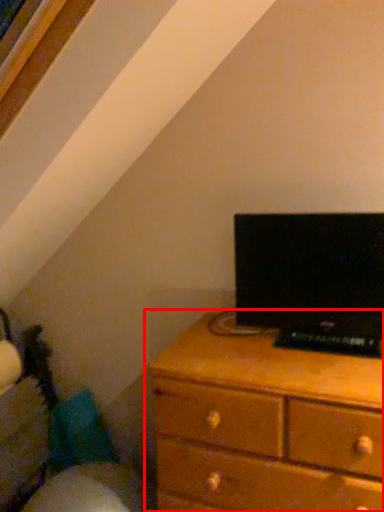
Question: In this image, where is chest of drawers (annotated by the red box) located relative to computer?

Choices:
 (A) left
 (B) right

Answer: (A)